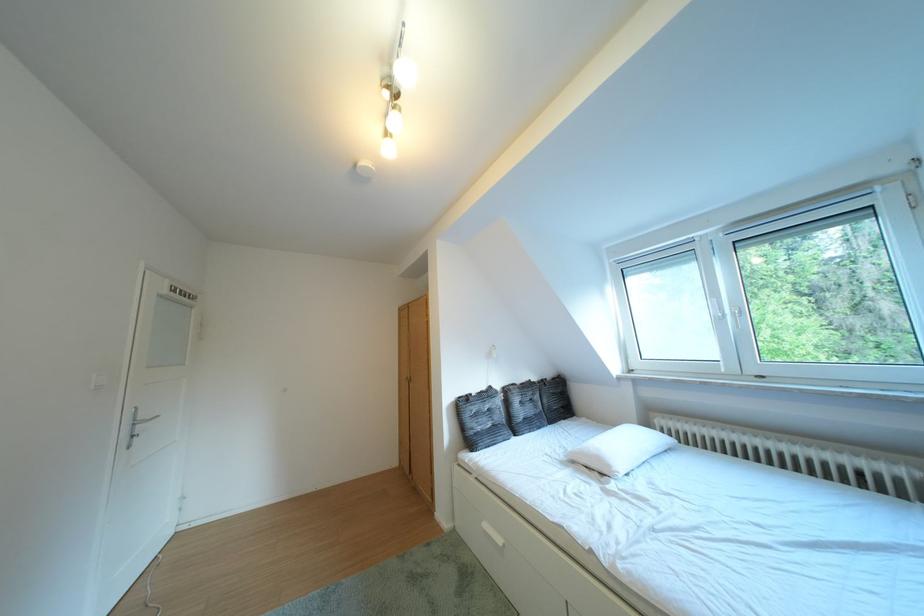
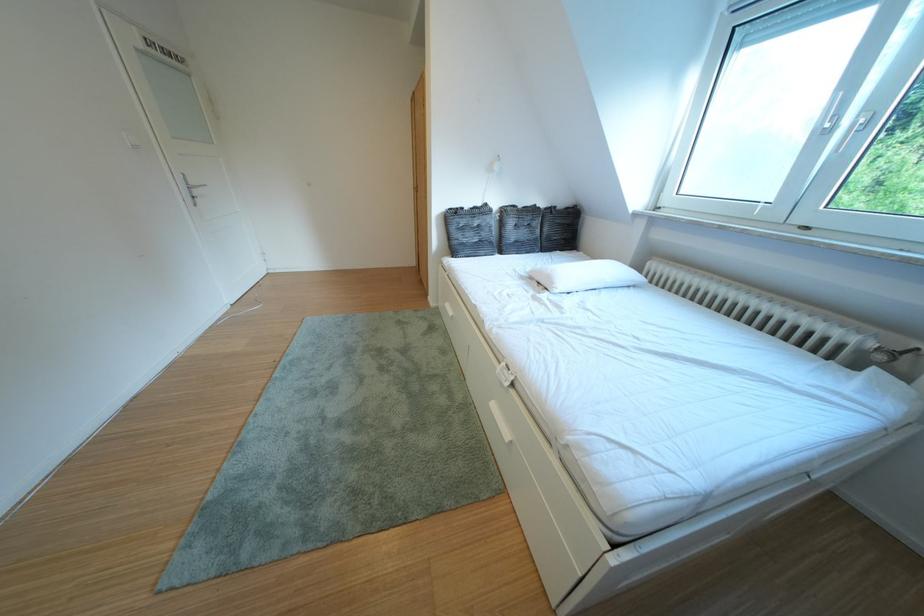
Find the pixel in the second image that matches [499,531] in the first image.

(460, 310)